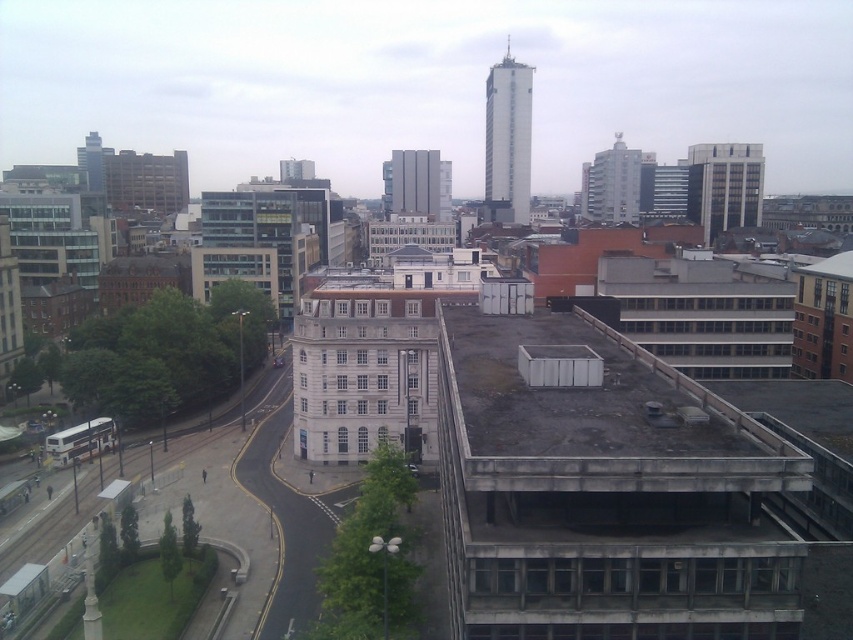
Is matte gray building at upper right taller than matte glass skyscraper at upper left?

Yes, matte gray building at upper right is taller than matte glass skyscraper at upper left.

Which is above, matte gray building at upper right or matte glass skyscraper at upper left?

matte glass skyscraper at upper left is above.

Identify the location of matte gray building at upper right. The width and height of the screenshot is (853, 640). (612, 184).

Where is `matte gray building at upper right`? This screenshot has width=853, height=640. matte gray building at upper right is located at coordinates (612, 184).

Who is higher up, white smooth tower at upper center or matte gray building at upper right?

Positioned higher is white smooth tower at upper center.

This screenshot has height=640, width=853. What do you see at coordinates (508, 136) in the screenshot?
I see `white smooth tower at upper center` at bounding box center [508, 136].

Which is behind, point (515, 125) or point (624, 154)?

The point (624, 154) is behind.

Identify the location of white smooth tower at upper center. (508, 136).

The height and width of the screenshot is (640, 853). Identify the location of white smooth tower at upper center. (x=508, y=136).

Which is more to the right, white smooth tower at upper center or white glass building at upper center?

Positioned to the right is white glass building at upper center.

Between point (503, 204) and point (715, 236), which one is positioned in front?

Point (715, 236) is in front.

Where is `white smooth tower at upper center`? white smooth tower at upper center is located at coordinates coord(508,136).